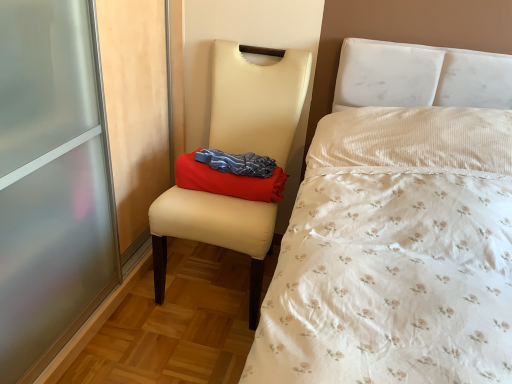
Locate an element on the screen. The width and height of the screenshot is (512, 384). space that is in front of matte cream chair at center is located at coordinates (x=173, y=347).